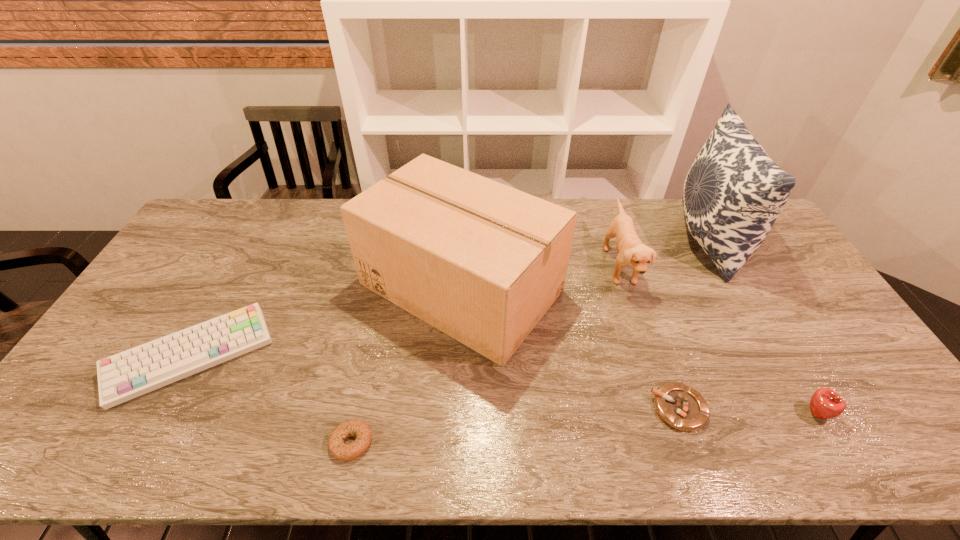
Identify the location of box located in the far edge section of the desktop. Image resolution: width=960 pixels, height=540 pixels. (482, 262).

Locate an element on the screen. The width and height of the screenshot is (960, 540). puppy that is at the far edge is located at coordinates (632, 252).

Identify the location of ashtray that is at the near edge. (683, 408).

Where is `bagel that is positioned at the near edge`? bagel that is positioned at the near edge is located at coordinates (344, 452).

Identify the location of object located at the left edge. (129, 374).

The image size is (960, 540). I want to click on object present at the right edge, so click(733, 193).

Find the location of a particular element. The height and width of the screenshot is (540, 960). object that is at the far right corner is located at coordinates (733, 193).

The image size is (960, 540). I want to click on vacant space at the far edge of the desktop, so click(x=683, y=236).

The height and width of the screenshot is (540, 960). In order to click on free space at the near edge of the desktop in this screenshot , I will do 671,457.

Identify the location of free space at the left edge of the desktop. (213, 270).